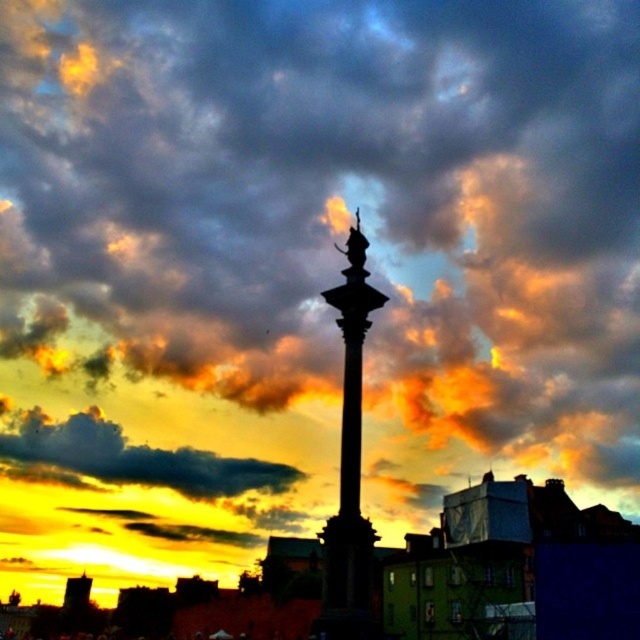
You are standing in front of the sunset scene and want to take a photo that includes both the polished stone column at center and the cloudy sky at upper center. Based on their positions, which one should you adjust your camera to focus on first to ensure both are in the frame?

Since the polished stone column at center is to the right of the cloudy sky at upper center, you should adjust your camera to focus on the cloudy sky at upper center first to ensure both are in the frame.

You are an architect designing a new sculpture. You want to place the polished stone column at center so that it appears balanced against the cloudy sky at upper center. Given their relative sizes, which object should be positioned where to achieve this balance?

The polished stone column at center is thinner than the cloudy sky at upper center. To achieve balance, place the thinner column closer to the viewer and the larger sky area further back, distributing visual weight appropriately.

You are standing at the camera position and want to take a photo of the polished stone column at center. If you walk 10 feet closer to the column, how far will you be from it?

The polished stone column at center and camera are 168.85 feet apart. After walking 10 feet closer, the distance becomes 168.85 minus 10, which equals 158.85 feet. Therefore, you will be 158.85 feet away from the polished stone column at center.